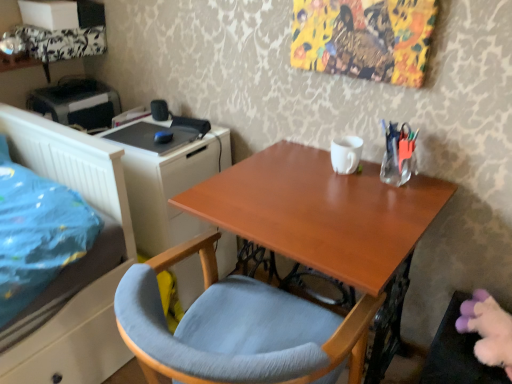
Where is `free spot above wooden desk at center (from a real-world perspective)`? This screenshot has width=512, height=384. free spot above wooden desk at center (from a real-world perspective) is located at coordinates (316, 193).